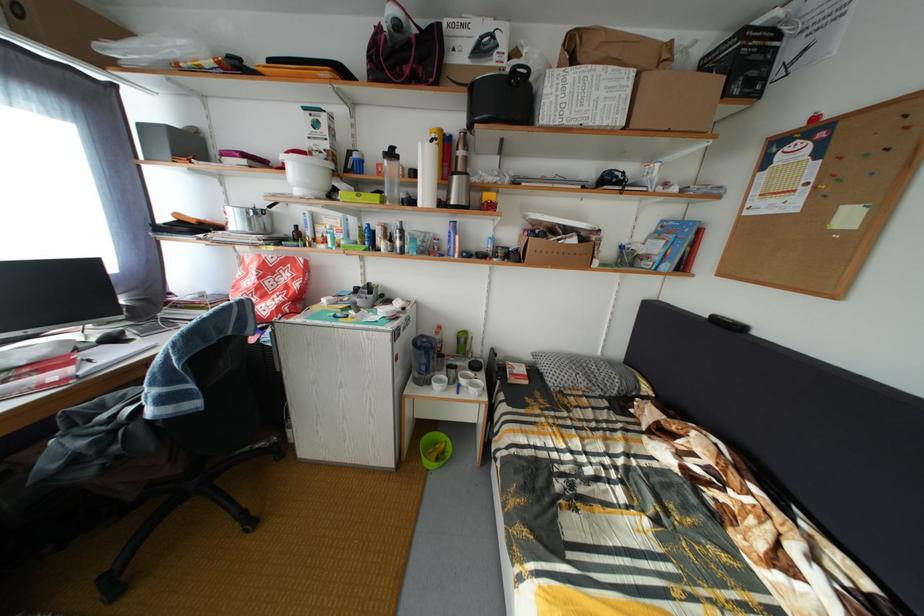
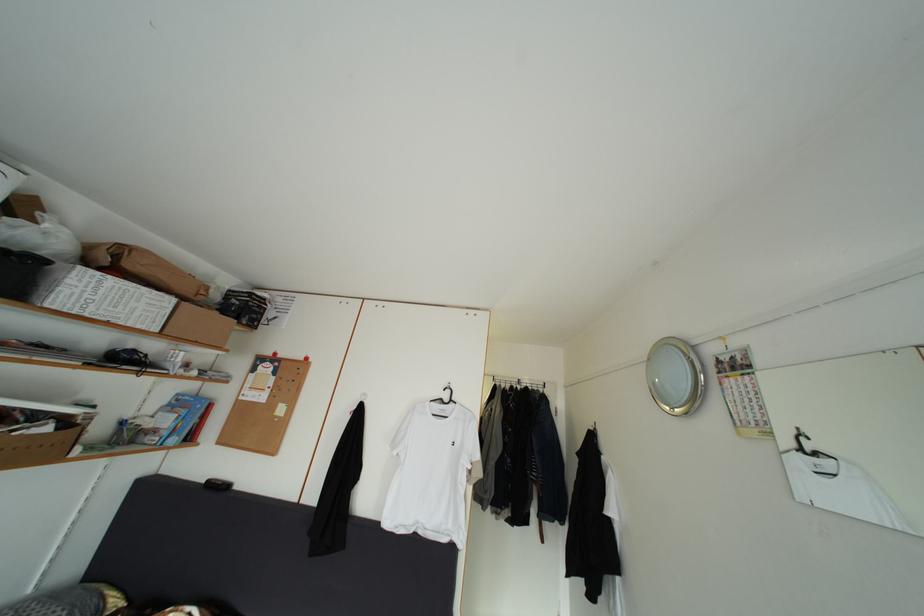
The images are taken continuously from a first-person perspective. In which direction is your viewpoint rotating?

The camera's rotation is toward right-up.